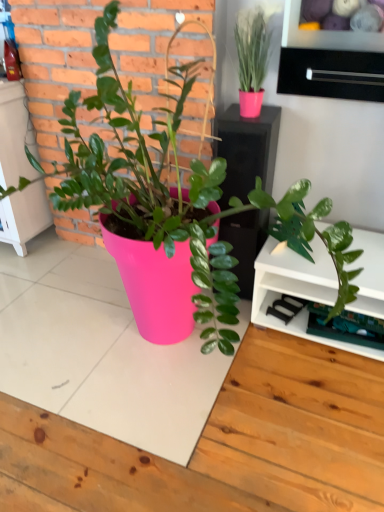
Locate an element on the screen. The width and height of the screenshot is (384, 512). empty space that is ontop of black matte drawer at upper right is located at coordinates (339, 44).